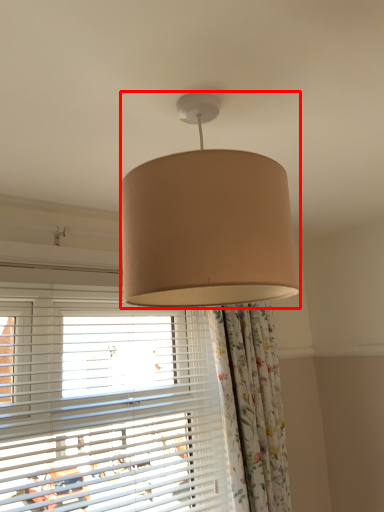
Question: From the image, what is the correct spatial relationship of lamp (annotated by the red box) in relation to window?

Choices:
 (A) right
 (B) left

Answer: (A)